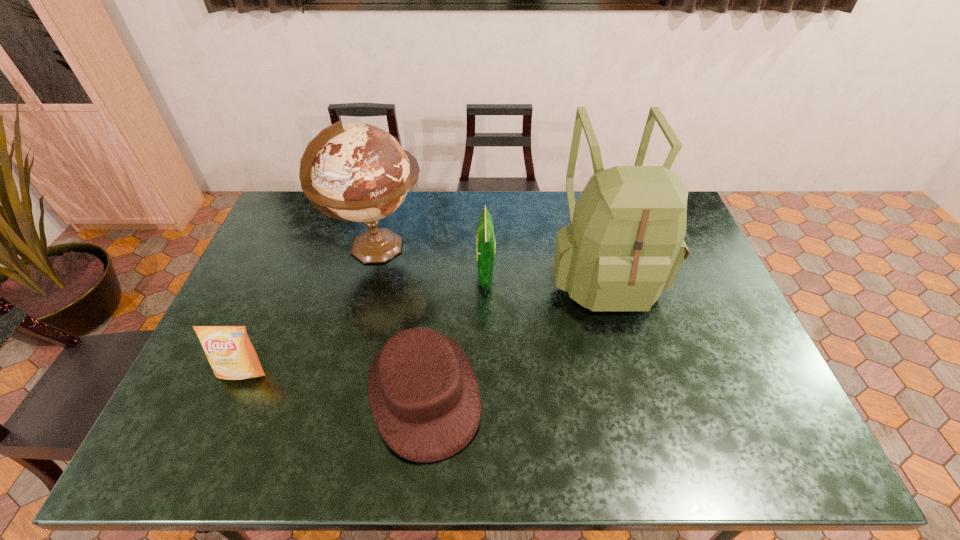
The height and width of the screenshot is (540, 960). Find the location of `free space at the left edge`. free space at the left edge is located at coordinates (205, 355).

Locate an element on the screen. vacant space at the right edge of the desktop is located at coordinates (695, 292).

You are a GUI agent. You are given a task and a screenshot of the screen. Output one action in this format:
    pyautogui.click(x=<x>, y=<y>)
    Task: Click on the vacant space at the near left corner
    This screenshot has height=540, width=960.
    Given the screenshot: What is the action you would take?
    (x=205, y=461)

This screenshot has height=540, width=960. I want to click on free space between the globe and the hat, so click(x=401, y=320).

Where is `free area in between the backpack and the shortest object`? free area in between the backpack and the shortest object is located at coordinates (514, 332).

The width and height of the screenshot is (960, 540). I want to click on free space between the hat and the rightmost object, so click(514, 332).

At what (x,y) coordinates should I click in order to perform the action: click on free space between the globe and the right crisp (potato chip). Please return your answer as a coordinate pair (x, y). Image resolution: width=960 pixels, height=540 pixels. Looking at the image, I should click on (432, 261).

The height and width of the screenshot is (540, 960). Identify the location of free area in between the taller crisp (potato chip) and the hat. (455, 334).

The width and height of the screenshot is (960, 540). I want to click on free area in between the hat and the globe, so click(401, 320).

The width and height of the screenshot is (960, 540). What are the coordinates of `free spot between the backpack and the shorter crisp (potato chip)` in the screenshot? It's located at (422, 321).